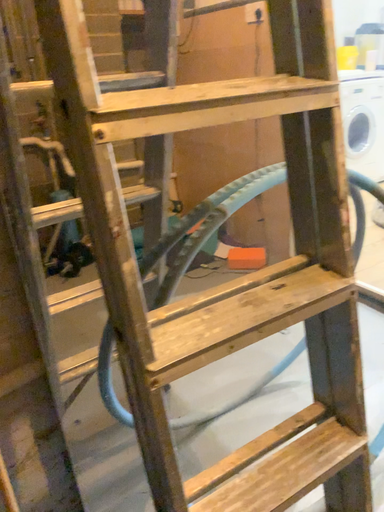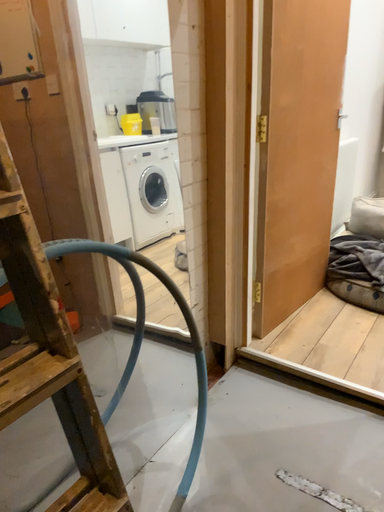
Question: How did the camera likely rotate when shooting the video?

Choices:
 (A) rotated downward
 (B) rotated upward

Answer: (B)